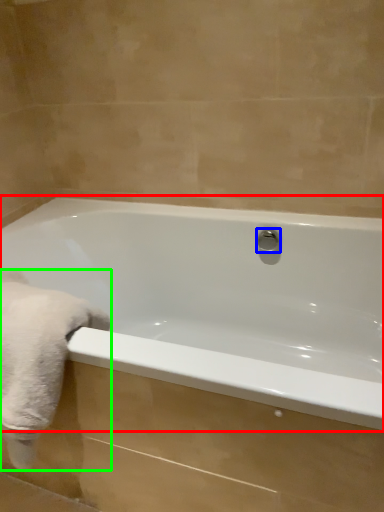
Question: Which object is positioned closest to bathtub (highlighted by a red box)? Select from shower (highlighted by a blue box) and bath towel (highlighted by a green box).

Choices:
 (A) shower
 (B) bath towel

Answer: (A)